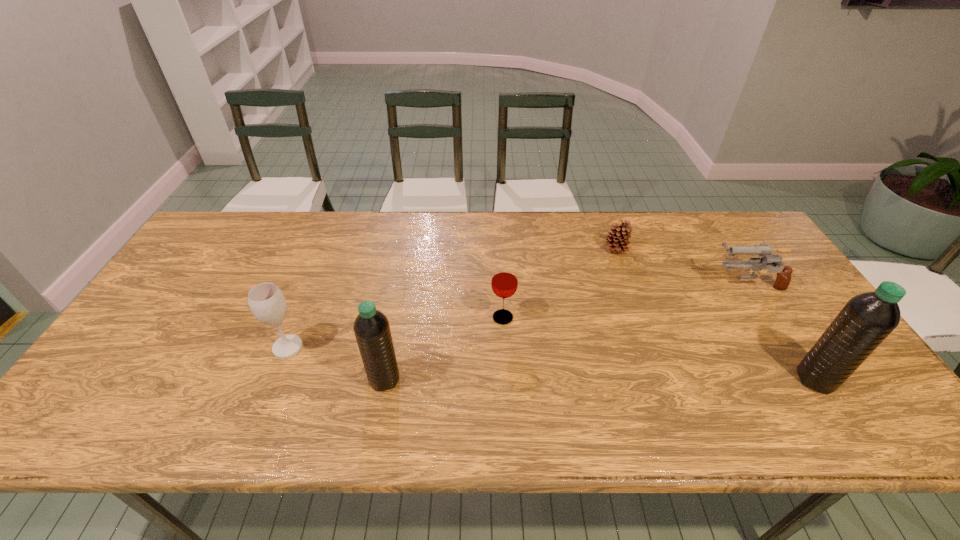
If equal spacing is desired by inserting an extra water_bottle among them, please point out a free spot for this new water_bottle. Please provide its 2D coordinates. Your answer should be formatted as a tuple, i.e. [(x, y)], where the tuple contains the x and y coordinates of a point satisfying the conditions above.

[(600, 379)]